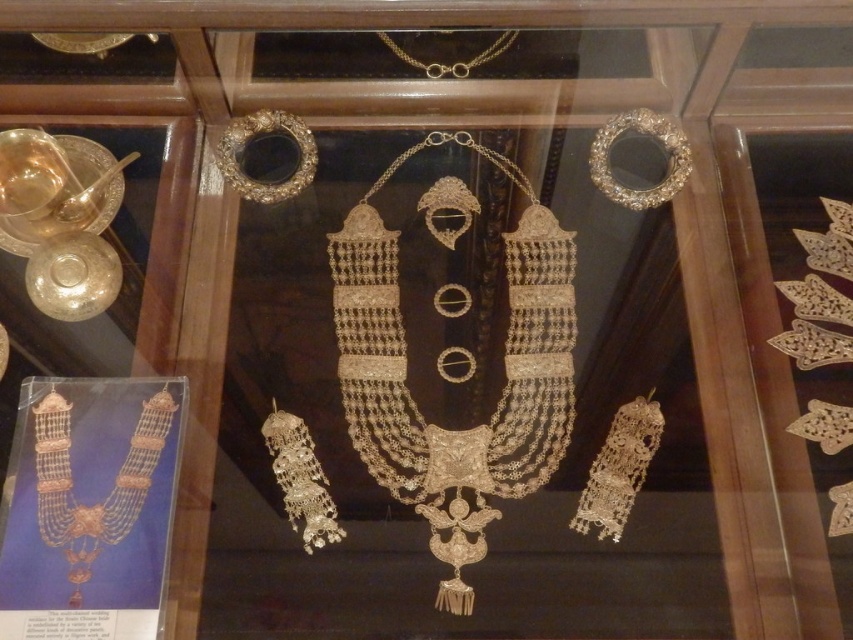
You are a curator arranging a new exhibit and want to ensure proper spacing between the silver metallic bangle at upper right and the gold chain at upper center. Based on their positions in the display case, which one is located lower in the image?

The silver metallic bangle at upper right is located below the gold chain at upper center, so it is lower in the image.

You are a jeweler examining the display case and want to locate the gold textured necklace at lower left. According to the coordinates provided, where exactly is it positioned in the display case?

The gold textured necklace at lower left is positioned at coordinates point [109,492] in the display case.